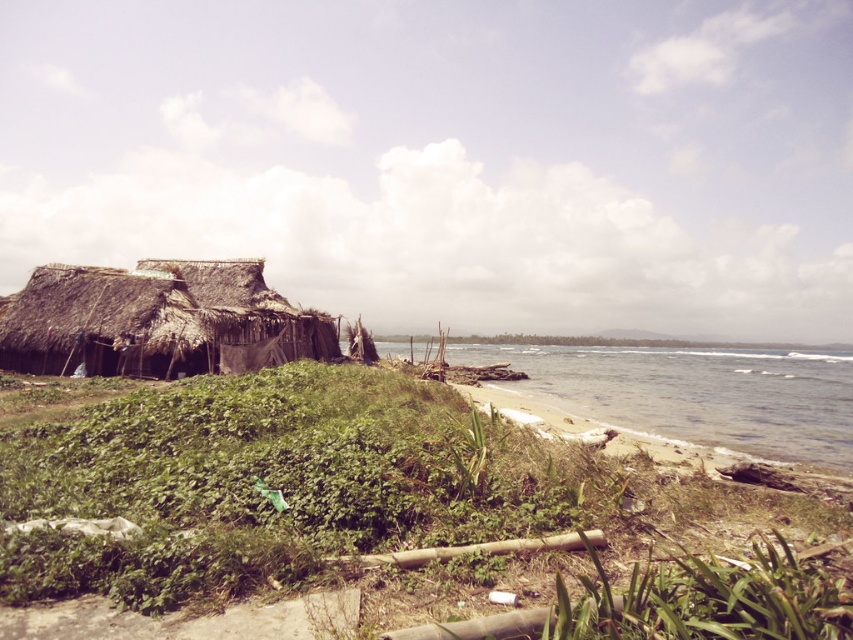
You are a visitor walking along the beach and notice green grass at lower left and a thatched straw hut at left. Which object is closer to the shoreline?

The green grass at lower left is closer to the shoreline since it is located below the thatched straw hut at left, which places it nearer to the water edge.

You are a tourist standing at the shoreline and want to take a photo of the clear water at lower right and the thatched straw hut at left. Which object is closer to the camera based on their positions in the image?

The clear water at lower right is closer to the camera than the thatched straw hut at left because objects lower in the image are typically closer to the viewer.